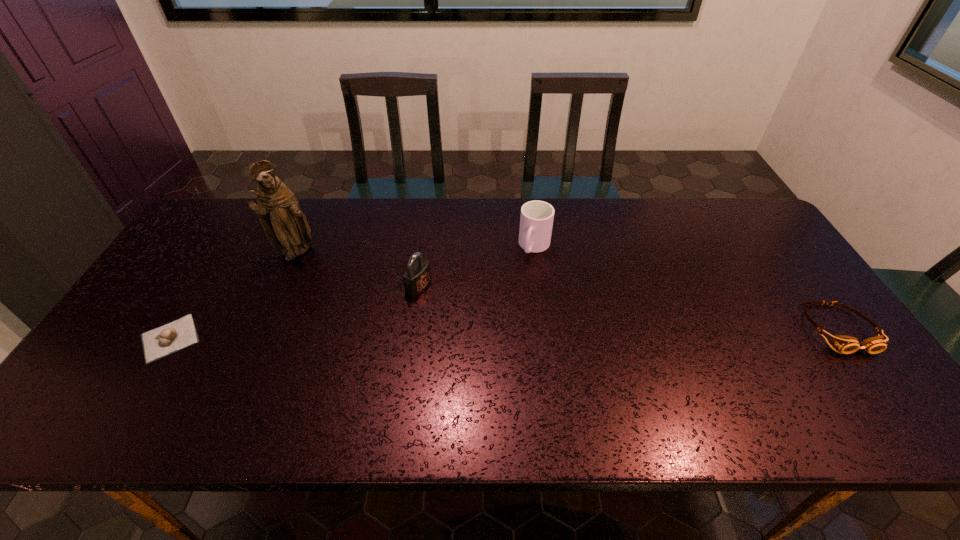
Locate an element on the screen. The width and height of the screenshot is (960, 540). figurine that is positioned at the far edge is located at coordinates (287, 229).

At what (x,y) coordinates should I click in order to perform the action: click on cup that is at the far edge. Please return your answer as a coordinate pair (x, y). Looking at the image, I should click on (536, 221).

The width and height of the screenshot is (960, 540). In order to click on object at the near edge in this screenshot , I will do `click(157, 343)`.

At what (x,y) coordinates should I click in order to perform the action: click on object at the left edge. Please return your answer as a coordinate pair (x, y). The width and height of the screenshot is (960, 540). Looking at the image, I should click on (157, 343).

Find the location of a particular element. object located in the right edge section of the desktop is located at coordinates (845, 344).

The image size is (960, 540). I want to click on object located at the near left corner, so click(157, 343).

Where is `free region at the far edge of the desktop`? The width and height of the screenshot is (960, 540). free region at the far edge of the desktop is located at coordinates (246, 244).

Locate an element on the screen. This screenshot has height=540, width=960. free space at the near edge is located at coordinates (269, 374).

Where is `free space at the right edge of the desktop`? This screenshot has height=540, width=960. free space at the right edge of the desktop is located at coordinates (801, 315).

You are a GUI agent. You are given a task and a screenshot of the screen. Output one action in this format:
    pyautogui.click(x=<x>, y=<y>)
    Task: Click on the vacant space at the far right corner of the desktop
    The height and width of the screenshot is (540, 960).
    Given the screenshot: What is the action you would take?
    (718, 211)